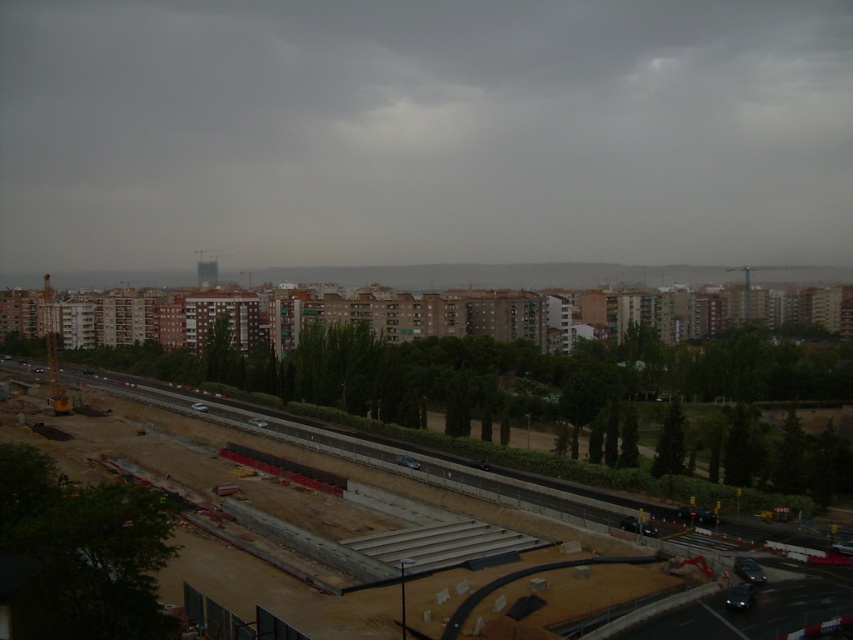
Which of these two, green leafy tree at lower left or green leafy tree at center, stands shorter?

green leafy tree at lower left

Describe the element at coordinates (82, 552) in the screenshot. This screenshot has width=853, height=640. I see `green leafy tree at lower left` at that location.

Locate an element on the screen. green leafy tree at lower left is located at coordinates (82, 552).

Where is `green leafy tree at lower left`? The height and width of the screenshot is (640, 853). green leafy tree at lower left is located at coordinates (82, 552).

Which is behind, point (172, 397) or point (206, 362)?

The point (206, 362) is behind.

Is point (541, 618) closer to camera compared to point (212, 378)?

Yes, it is.

What do you see at coordinates (413, 472) in the screenshot? The height and width of the screenshot is (640, 853). I see `concrete at center` at bounding box center [413, 472].

Locate an element on the screen. The image size is (853, 640). concrete at center is located at coordinates (413, 472).

Which is more to the left, green leafy tree at lower left or concrete at center?

concrete at center

Which is above, green leafy tree at lower left or concrete at center?

green leafy tree at lower left

Does point (42, 456) lie in front of point (186, 452)?

Yes.

Locate an element on the screen. The width and height of the screenshot is (853, 640). green leafy tree at lower left is located at coordinates (82, 552).